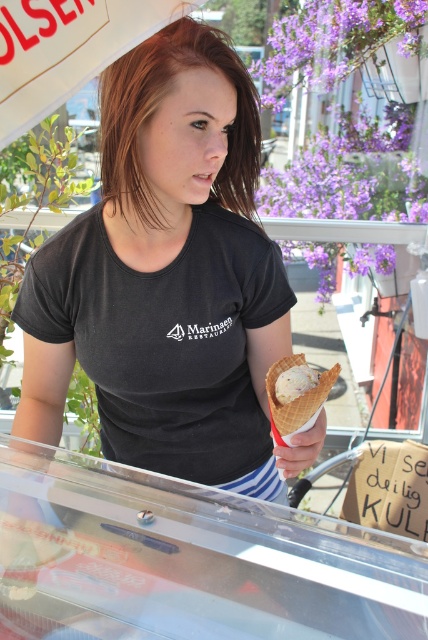
You are a customer at Marinaen Restaurang and want to place an order. You see two points on the counter where you can place your order. The first point is at coordinate point(169, 387) and the second is at point(314, 403). Which point is closer to you?

Point(314, 403) is closer to you because it is in front of point(169, 387).

You are a customer at Marinaen Restaurang and you see both the vanilla ice cream in waffle cone at center and the white creamy ice cream at center. Which one is bigger?

The vanilla ice cream in waffle cone at center is larger in size compared to the white creamy ice cream at center.